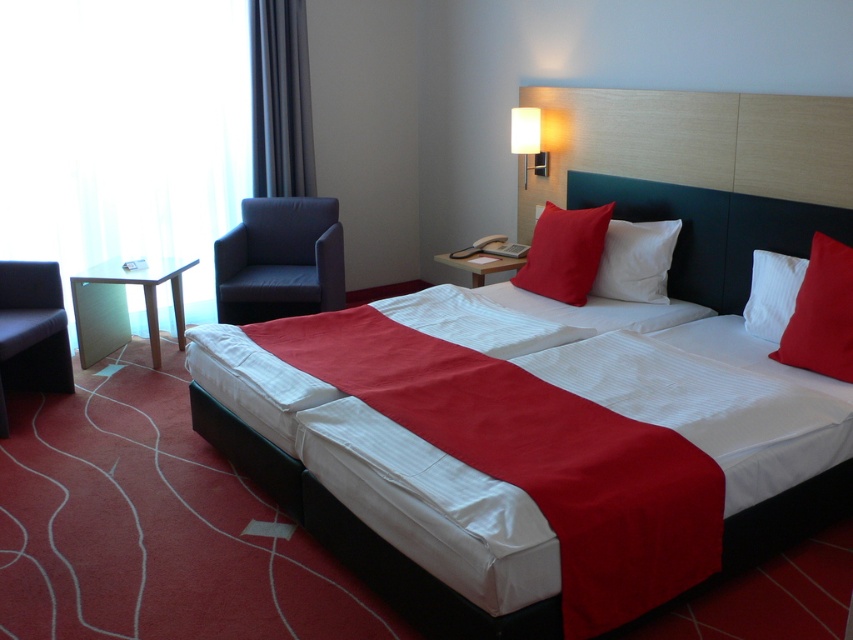
Does wooden paneling at upper right appear on the right side of matte red pillow at right?

No, wooden paneling at upper right is not to the right of matte red pillow at right.

Image resolution: width=853 pixels, height=640 pixels. I want to click on wooden paneling at upper right, so click(693, 141).

Can you confirm if matte dark gray armchair at left is positioned below light brown wooden side table at left?

No, matte dark gray armchair at left is not below light brown wooden side table at left.

Does matte dark gray armchair at left have a larger size compared to light brown wooden side table at left?

Correct, matte dark gray armchair at left is larger in size than light brown wooden side table at left.

Does point (302, 272) come closer to viewer compared to point (91, 300)?

No, it is behind (91, 300).

Locate an element on the screen. The height and width of the screenshot is (640, 853). matte dark gray armchair at left is located at coordinates (280, 260).

Does matte red pillow at right appear under white textured pillow at right?

Yes, matte red pillow at right is below white textured pillow at right.

Between matte red pillow at right and white textured pillow at right, which one is positioned higher?

white textured pillow at right

The image size is (853, 640). I want to click on matte red pillow at right, so click(821, 314).

Where is `matte red pillow at right`? This screenshot has height=640, width=853. matte red pillow at right is located at coordinates (821, 314).